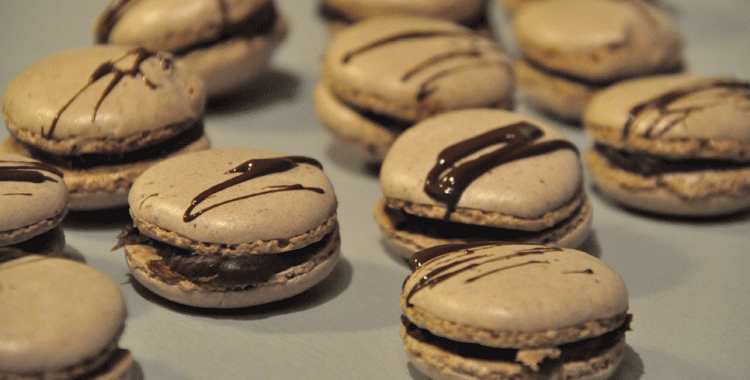
At what (x,y) coordinates should I click in order to perform the action: click on light gray surface. Please return your answer as a coordinate pair (x, y). The image size is (750, 380). Looking at the image, I should click on tap(358, 353).